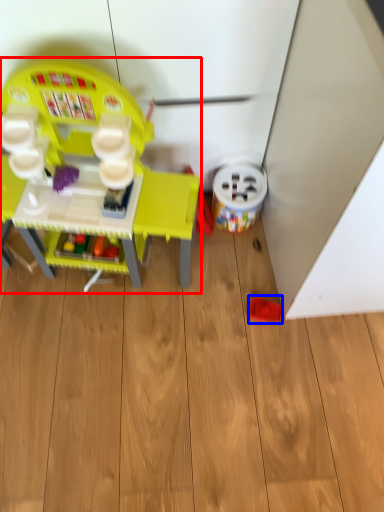
Question: Which point is closer to the camera, toy (highlighted by a red box) or toy (highlighted by a blue box)?

Choices:
 (A) toy
 (B) toy

Answer: (A)